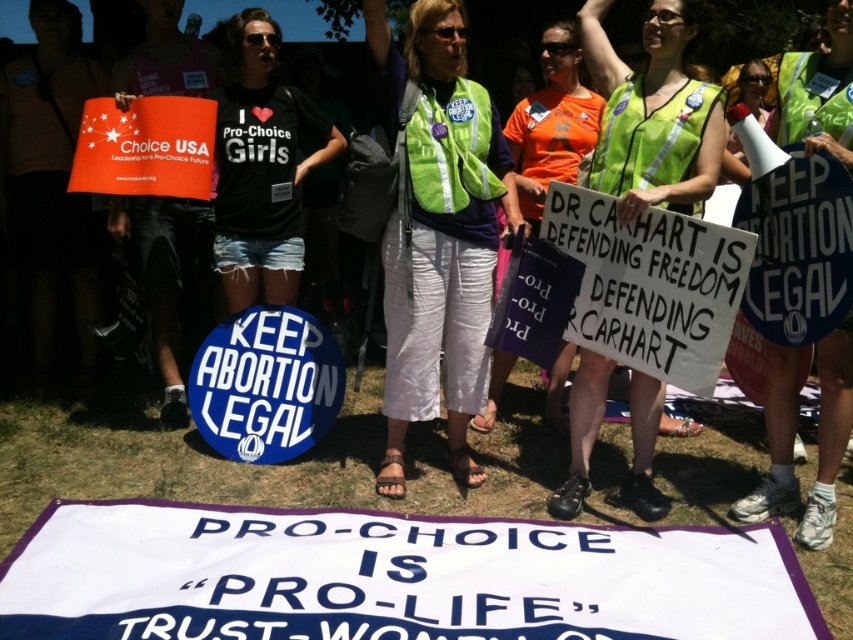
You are a photographer at the pro choice rally. You want to take a photo of the neon green safety vest at center and the green reflective vest at center. Which vest will appear closer to the camera in the photo?

The green reflective vest at center will appear closer to the camera because the neon green safety vest at center is behind it.